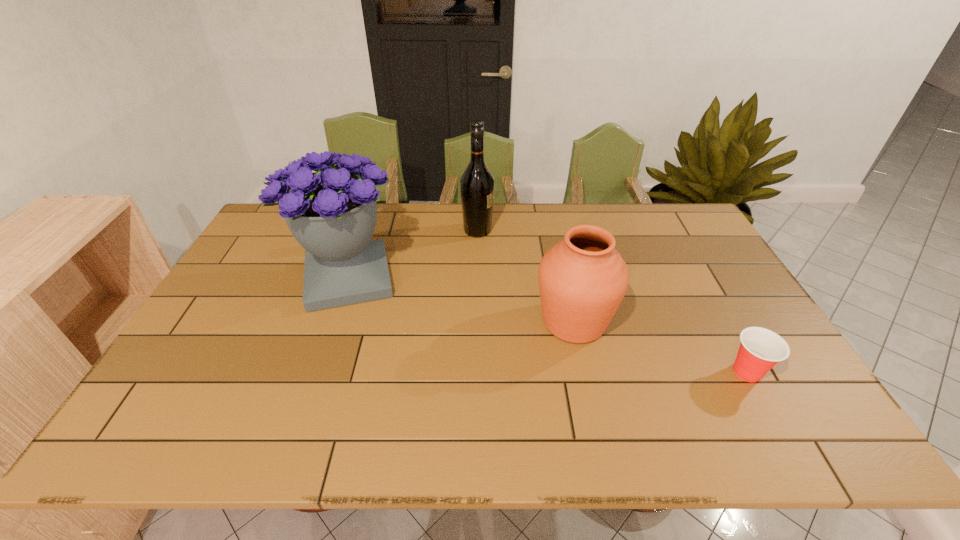
Identify the location of vacant space that's between the second object from left to right and the third tallest object. (526, 276).

Identify the location of empty space that is in between the farthest object and the third tallest object. (526, 276).

Locate an element on the screen. free area in between the nearest object and the second shortest object is located at coordinates (660, 347).

Locate an element on the screen. This screenshot has width=960, height=540. the second closest object to the third object from left to right is located at coordinates (477, 183).

At what (x,y) coordinates should I click in order to perform the action: click on the third closest object to the shortest object. Please return your answer as a coordinate pair (x, y). Looking at the image, I should click on (332, 213).

You are a GUI agent. You are given a task and a screenshot of the screen. Output one action in this format:
    pyautogui.click(x=<x>, y=<y>)
    Task: Click on the free spot that satisfies the following two spatial constraints: 1. on the label of the second object from left to right; 2. on the left side of the shortest object
    Image resolution: width=960 pixels, height=540 pixels.
    Given the screenshot: What is the action you would take?
    pyautogui.click(x=476, y=372)

You are a GUI agent. You are given a task and a screenshot of the screen. Output one action in this format:
    pyautogui.click(x=<x>, y=<y>)
    Task: Click on the free location that satisfies the following two spatial constraints: 1. on the label of the urn; 2. on the left side of the wine bottle
    This screenshot has height=540, width=960.
    Given the screenshot: What is the action you would take?
    pyautogui.click(x=477, y=322)

At what (x,y) coordinates should I click in order to perform the action: click on vacant space that satisfies the following two spatial constraints: 1. on the back side of the second shortest object; 2. on the label of the farthest object. Please return your answer as a coordinate pair (x, y). The width and height of the screenshot is (960, 540). Looking at the image, I should click on (554, 231).

The width and height of the screenshot is (960, 540). Find the location of `vacant position in the image that satisfies the following two spatial constraints: 1. on the label of the farthest object; 2. on the right side of the second object from right to left`. vacant position in the image that satisfies the following two spatial constraints: 1. on the label of the farthest object; 2. on the right side of the second object from right to left is located at coordinates (477, 322).